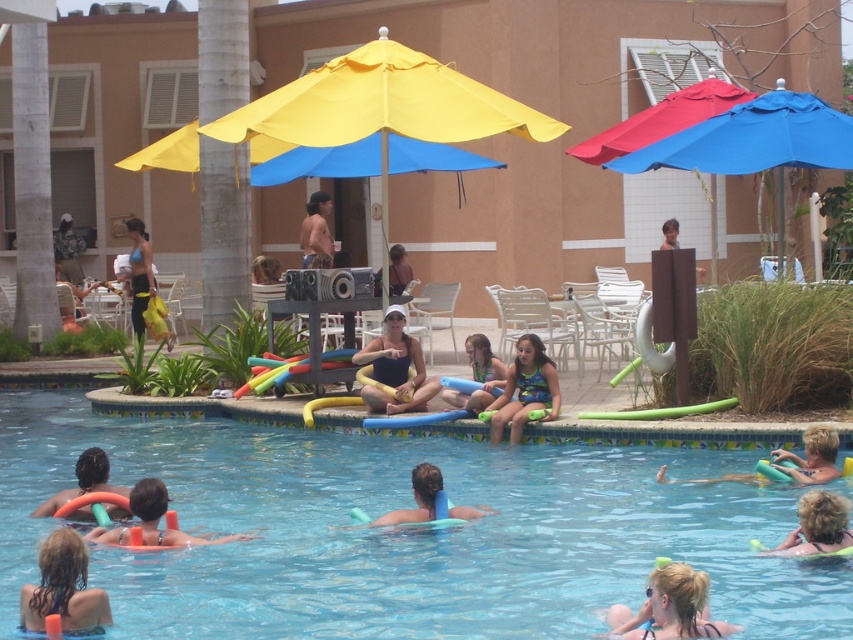
Question: Is light blue foam float at lower right below matte yellow shorts at left?

Choices:
 (A) yes
 (B) no

Answer: (A)

Question: Is multicolored swimsuit at poolside wider than matte orange float at lower left?

Choices:
 (A) no
 (B) yes

Answer: (A)

Question: Which object is positioned closest to the light blue foam float at lower right?

Choices:
 (A) blonde hair at lower right
 (B) dark brown hair at lower left
 (C) green rubber pool noodle at center
 (D) multicolored swimsuit at poolside

Answer: (A)

Question: Based on their relative distances, which object is farther from the matte blue swimsuit at center?

Choices:
 (A) dark brown hair at lower left
 (B) brown leather jacket at upper center

Answer: (A)

Question: Which of these objects is positioned closest to the matte orange float at lower left?

Choices:
 (A) brown leather jacket at upper center
 (B) orange foam ring at lower left

Answer: (B)

Question: Can you confirm if multicolored swimsuit at poolside is smaller than blonde hair at lower right?

Choices:
 (A) yes
 (B) no

Answer: (B)